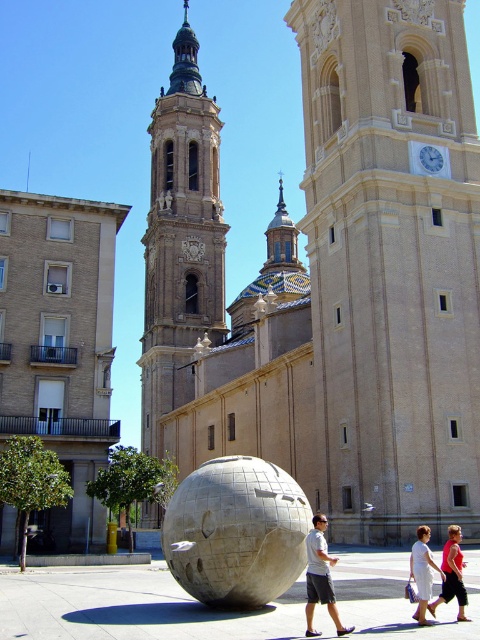
Who is positioned more to the left, smooth beige tower at center or stone sphere at center?

smooth beige tower at center is more to the left.

This screenshot has width=480, height=640. What are the coordinates of `smooth beige tower at center` in the screenshot? It's located at (180, 241).

Is beige stone church at center bigger than matte gray sphere at center?

Yes.

Does beige stone church at center have a lesser width compared to matte gray sphere at center?

No, beige stone church at center is not thinner than matte gray sphere at center.

Does point (403, 100) lie in front of point (324, 595)?

No, (403, 100) is further to viewer.

Where is `beige stone church at center`? The image size is (480, 640). beige stone church at center is located at coordinates (332, 278).

Who is lower down, smooth beige tower at center or white cotton dress at lower center?

white cotton dress at lower center

Does smooth beige tower at center appear on the left side of white cotton dress at lower center?

Indeed, smooth beige tower at center is positioned on the left side of white cotton dress at lower center.

Does point (200, 284) lie behind point (416, 582)?

Yes, it is behind point (416, 582).

Locate an element on the screen. The height and width of the screenshot is (640, 480). smooth beige tower at center is located at coordinates (180, 241).